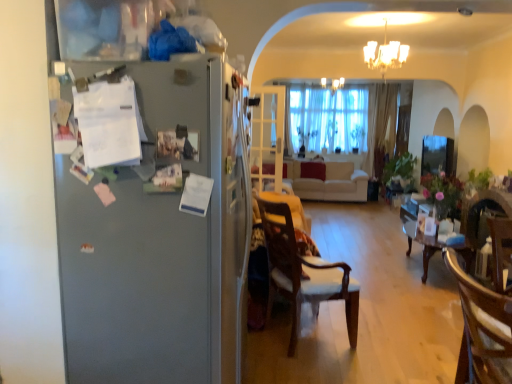
Identify the location of beige fabric couch at center. (330, 183).

Measure the distance between white glass door at center and camera.

white glass door at center and camera are 6.11 meters apart from each other.

Find the location of a particular element. This screenshot has width=512, height=384. white glass chandelier at upper center, acting as the first light fixture starting from the front is located at coordinates (385, 54).

What is the approximate height of white glass chandelier at upper center, the second light fixture positioned from the top?

white glass chandelier at upper center, the second light fixture positioned from the top, is 24.65 inches in height.

Image resolution: width=512 pixels, height=384 pixels. Describe the element at coordinates (437, 155) in the screenshot. I see `transparent glass window screen at center` at that location.

This screenshot has height=384, width=512. What do you see at coordinates (159, 245) in the screenshot? I see `satin silver refrigerator at left` at bounding box center [159, 245].

The image size is (512, 384). In order to click on beige fabric couch at center in this screenshot , I will do `click(330, 183)`.

Considering the sizes of objects beige fabric couch at center and white glass chandelier at upper center, acting as the first light fixture starting from the front, in the image provided, who is smaller, beige fabric couch at center or white glass chandelier at upper center, acting as the first light fixture starting from the front,?

white glass chandelier at upper center, acting as the first light fixture starting from the front, is smaller.

Would you say beige fabric couch at center is inside or outside white glass chandelier at upper center, the second light fixture positioned from the top?

beige fabric couch at center is outside white glass chandelier at upper center, the second light fixture positioned from the top.

In terms of height, does beige fabric couch at center look taller or shorter compared to white glass chandelier at upper center, acting as the second light fixture starting from the back?

Considering their sizes, beige fabric couch at center has more height than white glass chandelier at upper center, acting as the second light fixture starting from the back.

Looking at this image, from the image's perspective, which is below, beige fabric couch at center or white glass chandelier at upper center, acting as the first light fixture starting from the front?

beige fabric couch at center is shown below in the image.

Does wooden chair at center, the first chair in the left-to-right sequence, have a greater height compared to white glass chandelier at upper center, acting as the second light fixture starting from the back?

Yes, wooden chair at center, the first chair in the left-to-right sequence, is taller than white glass chandelier at upper center, acting as the second light fixture starting from the back.

Considering the sizes of wooden chair at center, the second chair when ordered from right to left, and white glass chandelier at upper center, acting as the second light fixture starting from the back, in the image, is wooden chair at center, the second chair when ordered from right to left, wider or thinner than white glass chandelier at upper center, acting as the second light fixture starting from the back,?

In the image, wooden chair at center, the second chair when ordered from right to left, appears to be wider than white glass chandelier at upper center, acting as the second light fixture starting from the back.

Starting from the white glass chandelier at upper center, the second light fixture positioned from the top, which chair is the 2nd one to the left? Please provide its 2D coordinates.

[(303, 273)]

How many degrees apart are the facing directions of wooden chair at center, which ranks as the 2th chair in front-to-back order, and white glass chandelier at upper center, acting as the second light fixture starting from the back?

They differ by 65.7 degrees in their facing directions.

Is white glass door at center to the right of white glass chandelier at upper center, the second light fixture positioned from the top, from the viewer's perspective?

Incorrect, white glass door at center is not on the right side of white glass chandelier at upper center, the second light fixture positioned from the top.

Is white glass door at center with white glass chandelier at upper center, the second light fixture positioned from the top?

No, white glass door at center is not next to white glass chandelier at upper center, the second light fixture positioned from the top.

From a real-world perspective, which is physically above, white glass door at center or white glass chandelier at upper center, acting as the second light fixture starting from the back?

white glass chandelier at upper center, acting as the second light fixture starting from the back, from a real-world perspective.

Measure the distance between satin silver refrigerator at left and wooden chair at lower right, the 2th chair viewed from the left.

satin silver refrigerator at left is 1.13 meters away from wooden chair at lower right, the 2th chair viewed from the left.

Is satin silver refrigerator at left not close to wooden chair at lower right, the 2th chair viewed from the left?

Yes, satin silver refrigerator at left is far from wooden chair at lower right, the 2th chair viewed from the left.

From the picture: Does satin silver refrigerator at left have a larger size compared to wooden chair at lower right, the first chair when ordered from right to left?

Yes, satin silver refrigerator at left is bigger than wooden chair at lower right, the first chair when ordered from right to left.

Is satin silver refrigerator at left facing away from wooden chair at lower right, which appears as the 1th chair when viewed from the front?

No, satin silver refrigerator at left is not facing the opposite direction of wooden chair at lower right, which appears as the 1th chair when viewed from the front.

Based on the photo, relative to transparent glass window screen at center, is satin silver refrigerator at left in front or behind?

Clearly, satin silver refrigerator at left is in front of transparent glass window screen at center.

Could you tell me if satin silver refrigerator at left is turned towards transparent glass window screen at center?

No.

Identify the location of fridge below the transparent glass window screen at center (from a real-world perspective). coord(159,245).

Are transparent glass window screen at center and wooden chair at center, the first chair in the left-to-right sequence, located far from each other?

Yes.

Is transparent glass window screen at center in front of or behind wooden chair at center, which is the first chair from back to front, in the image?

In the image, transparent glass window screen at center appears behind wooden chair at center, which is the first chair from back to front.

Does transparent glass window screen at center turn towards wooden chair at center, which ranks as the 2th chair in front-to-back order?

No, transparent glass window screen at center does not turn towards wooden chair at center, which ranks as the 2th chair in front-to-back order.

How many degrees apart are the facing directions of transparent glass window screen at center and wooden chair at center, which is the first chair from back to front?

The angular difference between transparent glass window screen at center and wooden chair at center, which is the first chair from back to front, is 151 degrees.

Can wooden chair at center, the second chair when ordered from right to left, be found inside white glass chandelier at upper center, the second light fixture viewed from the front?

That's incorrect, wooden chair at center, the second chair when ordered from right to left, is not inside white glass chandelier at upper center, the second light fixture viewed from the front.

Consider the image. Does white glass chandelier at upper center, the second light fixture viewed from the front, lie behind wooden chair at center, which ranks as the 2th chair in front-to-back order?

Yes, white glass chandelier at upper center, the second light fixture viewed from the front, is further from the viewer.

Considering the positions of objects white glass chandelier at upper center, placed as the 2th light fixture when sorted from bottom to top, and wooden chair at center, which ranks as the 2th chair in front-to-back order, in the image provided, who is more to the left, white glass chandelier at upper center, placed as the 2th light fixture when sorted from bottom to top, or wooden chair at center, which ranks as the 2th chair in front-to-back order,?

From the viewer's perspective, wooden chair at center, which ranks as the 2th chair in front-to-back order, appears more on the left side.

Considering the relative sizes of white glass chandelier at upper center, placed as the 2th light fixture when sorted from bottom to top, and wooden chair at center, which ranks as the 2th chair in front-to-back order, in the image provided, is white glass chandelier at upper center, placed as the 2th light fixture when sorted from bottom to top, bigger than wooden chair at center, which ranks as the 2th chair in front-to-back order,?

No.

I want to click on studio couch behind the white glass chandelier at upper center, acting as the second light fixture starting from the back, so click(330, 183).

There is a white glass chandelier at upper center, acting as the first light fixture starting from the front. Where is `the 1st chair below it (from the image's perspective)`? This screenshot has width=512, height=384. the 1st chair below it (from the image's perspective) is located at coordinates (303, 273).

Considering their positions, is white glass chandelier at upper center, the second light fixture viewed from the front, positioned closer to satin silver refrigerator at left than wooden chair at center, the second chair when ordered from right to left?

Among the two, wooden chair at center, the second chair when ordered from right to left, is located nearer to satin silver refrigerator at left.

Looking at the image, which one is located further to white glass door at center, white glass chandelier at upper center, the first light fixture in the bottom-to-top sequence, or satin silver refrigerator at left?

Among the two, satin silver refrigerator at left is located further to white glass door at center.

Which object lies further to the anchor point wooden chair at center, the first chair in the left-to-right sequence, transparent glass window screen at center or white glass chandelier at upper center, which appears as the first light fixture when viewed from the back?

white glass chandelier at upper center, which appears as the first light fixture when viewed from the back, is positioned further to the anchor wooden chair at center, the first chair in the left-to-right sequence.

Estimate the real-world distances between objects in this image. Which object is closer to wooden chair at center, the first chair in the left-to-right sequence, wooden chair at lower right, which appears as the 1th chair when viewed from the front, or white glass chandelier at upper center, acting as the first light fixture starting from the front?

wooden chair at lower right, which appears as the 1th chair when viewed from the front, is closer to wooden chair at center, the first chair in the left-to-right sequence.

When comparing their distances from transparent glass window screen at center, does white glass chandelier at upper center, acting as the second light fixture starting from the back, or wooden chair at center, which ranks as the 2th chair in front-to-back order, seem further?

Among the two, wooden chair at center, which ranks as the 2th chair in front-to-back order, is located further to transparent glass window screen at center.

Considering their positions, is white glass chandelier at upper center, the second light fixture viewed from the front, positioned further to white glass chandelier at upper center, acting as the first light fixture starting from the front, than wooden chair at lower right, the first chair when ordered from right to left?

Based on the image, wooden chair at lower right, the first chair when ordered from right to left, appears to be further to white glass chandelier at upper center, acting as the first light fixture starting from the front.

When comparing their distances from white glass chandelier at upper center, acting as the first light fixture starting from the front, does wooden chair at lower right, the 2th chair viewed from the left, or white glass chandelier at upper center, the second light fixture viewed from the front, seem closer?

white glass chandelier at upper center, the second light fixture viewed from the front, is positioned closer to the anchor white glass chandelier at upper center, acting as the first light fixture starting from the front.

Estimate the real-world distances between objects in this image. Which object is closer to white glass chandelier at upper center, the first light fixture in the bottom-to-top sequence, satin silver refrigerator at left or wooden chair at center, the second chair when ordered from right to left?

wooden chair at center, the second chair when ordered from right to left, is closer to white glass chandelier at upper center, the first light fixture in the bottom-to-top sequence.

At what (x,y) coordinates should I click in order to perform the action: click on window screen located between wooden chair at center, which ranks as the 2th chair in front-to-back order, and beige fabric couch at center in the depth direction. Please return your answer as a coordinate pair (x, y). Looking at the image, I should click on (437, 155).

The height and width of the screenshot is (384, 512). I want to click on fridge located between wooden chair at lower right, the first chair when ordered from right to left, and transparent glass window screen at center in the depth direction, so (x=159, y=245).

At what (x,y) coordinates should I click in order to perform the action: click on glass door positioned between white glass chandelier at upper center, acting as the first light fixture starting from the front, and white glass chandelier at upper center, the first light fixture in the top-to-bottom sequence, from near to far. Please return your answer as a coordinate pair (x, y). The width and height of the screenshot is (512, 384). Looking at the image, I should click on (268, 138).

This screenshot has width=512, height=384. Find the location of `window screen between white glass door at center and white glass chandelier at upper center, placed as the 2th light fixture when sorted from bottom to top, along the z-axis`. window screen between white glass door at center and white glass chandelier at upper center, placed as the 2th light fixture when sorted from bottom to top, along the z-axis is located at coordinates (437, 155).